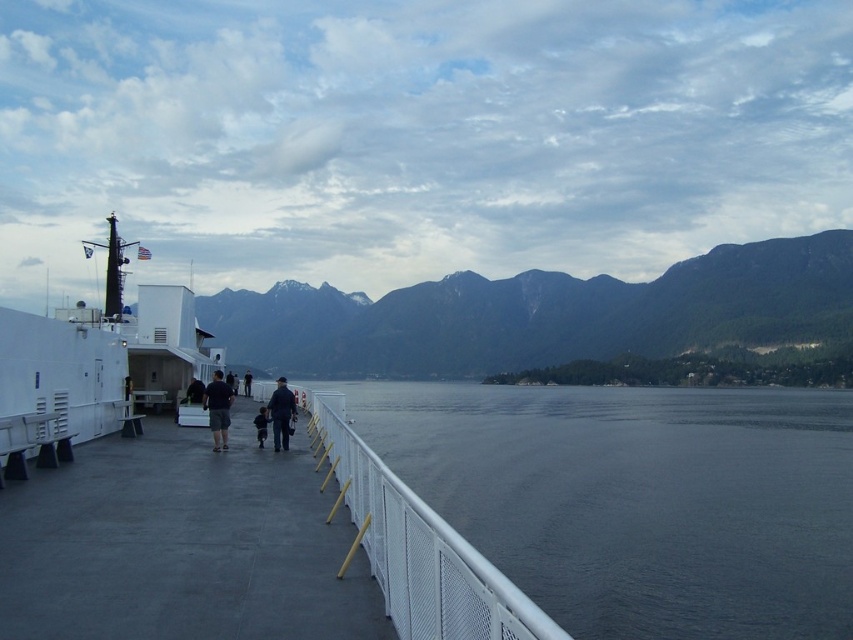
Question: Among these points, which one is farthest from the camera?

Choices:
 (A) (259, 419)
 (B) (270, 410)
 (C) (730, 451)

Answer: (C)

Question: Among these objects, which one is nearest to the camera?

Choices:
 (A) dark blue jeans at center
 (B) dark gray fabric jacket at center

Answer: (A)

Question: Which point is farther to the camera?

Choices:
 (A) (78, 556)
 (B) (537, 496)
 (C) (218, 392)
 (D) (289, 433)

Answer: (B)

Question: Considering the relative positions of dark blue jeans at center and black fabric jacket at center in the image provided, where is dark blue jeans at center located with respect to black fabric jacket at center?

Choices:
 (A) above
 (B) below

Answer: (B)

Question: Is white matte deck at center bigger than dark blue fabric at center?

Choices:
 (A) no
 (B) yes

Answer: (B)

Question: Can you confirm if dark blue fabric at center is positioned to the right of dark gray fabric jacket at center?

Choices:
 (A) no
 (B) yes

Answer: (B)